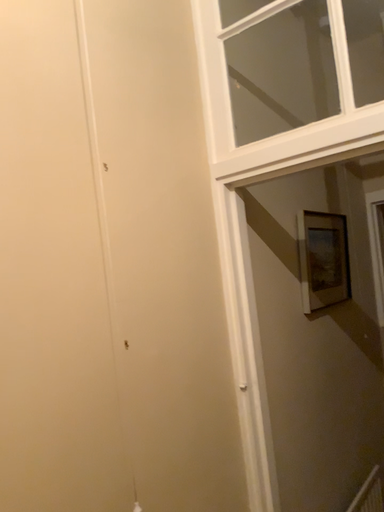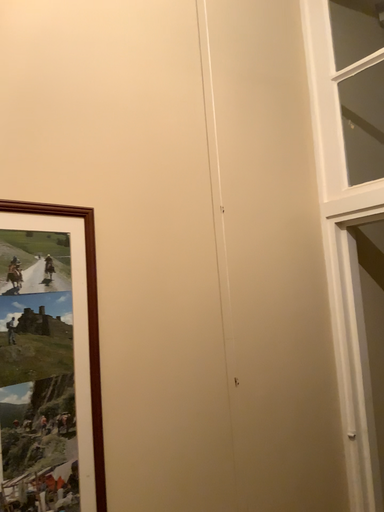
Question: How did the camera likely rotate when shooting the video?

Choices:
 (A) rotated right
 (B) rotated left

Answer: (B)